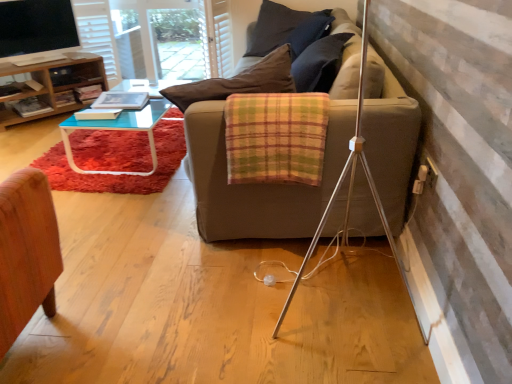
Question: Is white textured curtain at upper center oriented away from matte black screen at upper left?

Choices:
 (A) no
 (B) yes

Answer: (A)

Question: Is white textured curtain at upper center at the right side of matte black screen at upper left?

Choices:
 (A) yes
 (B) no

Answer: (A)

Question: Considering the relative sizes of white textured curtain at upper center and matte black screen at upper left in the image provided, is white textured curtain at upper center wider than matte black screen at upper left?

Choices:
 (A) no
 (B) yes

Answer: (B)

Question: Does white textured curtain at upper center have a greater height compared to matte black screen at upper left?

Choices:
 (A) no
 (B) yes

Answer: (B)

Question: Is white textured curtain at upper center not inside matte black screen at upper left?

Choices:
 (A) yes
 (B) no

Answer: (A)

Question: Is white textured curtain at upper center at the left side of matte black screen at upper left?

Choices:
 (A) yes
 (B) no

Answer: (B)

Question: Are plaid fabric blanket at center and matte black screen at upper left beside each other?

Choices:
 (A) no
 (B) yes

Answer: (A)

Question: From a real-world perspective, does plaid fabric blanket at center sit lower than matte black screen at upper left?

Choices:
 (A) yes
 (B) no

Answer: (A)

Question: Considering the relative positions of plaid fabric blanket at center and matte black screen at upper left in the image provided, is plaid fabric blanket at center in front of matte black screen at upper left?

Choices:
 (A) no
 (B) yes

Answer: (B)

Question: Is plaid fabric blanket at center to the left of matte black screen at upper left from the viewer's perspective?

Choices:
 (A) no
 (B) yes

Answer: (A)

Question: Is plaid fabric blanket at center shorter than matte black screen at upper left?

Choices:
 (A) no
 (B) yes

Answer: (B)

Question: From the image's perspective, is plaid fabric blanket at center on top of matte black screen at upper left?

Choices:
 (A) yes
 (B) no

Answer: (B)

Question: Considering the relative sizes of white textured curtain at upper center and plaid fabric blanket at center in the image provided, is white textured curtain at upper center wider than plaid fabric blanket at center?

Choices:
 (A) yes
 (B) no

Answer: (A)